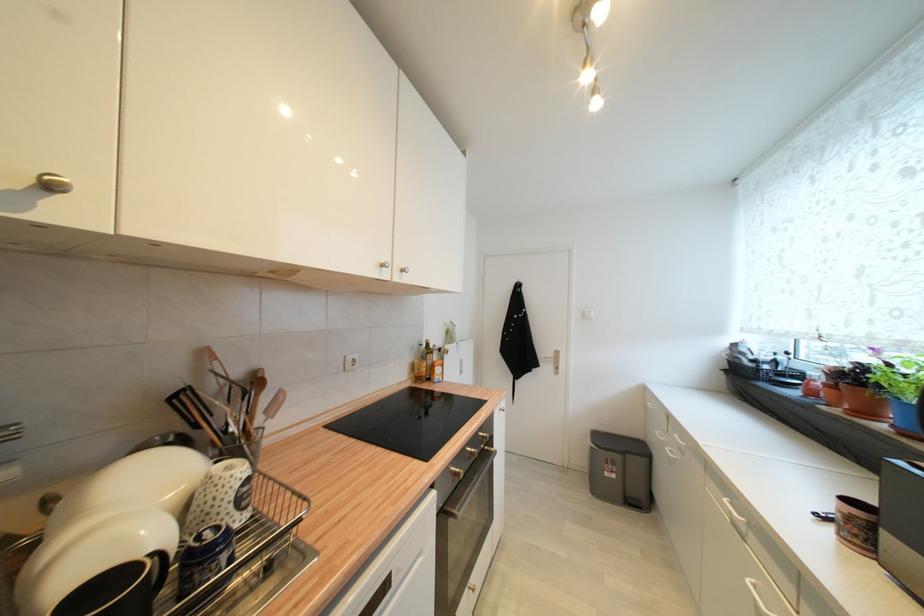
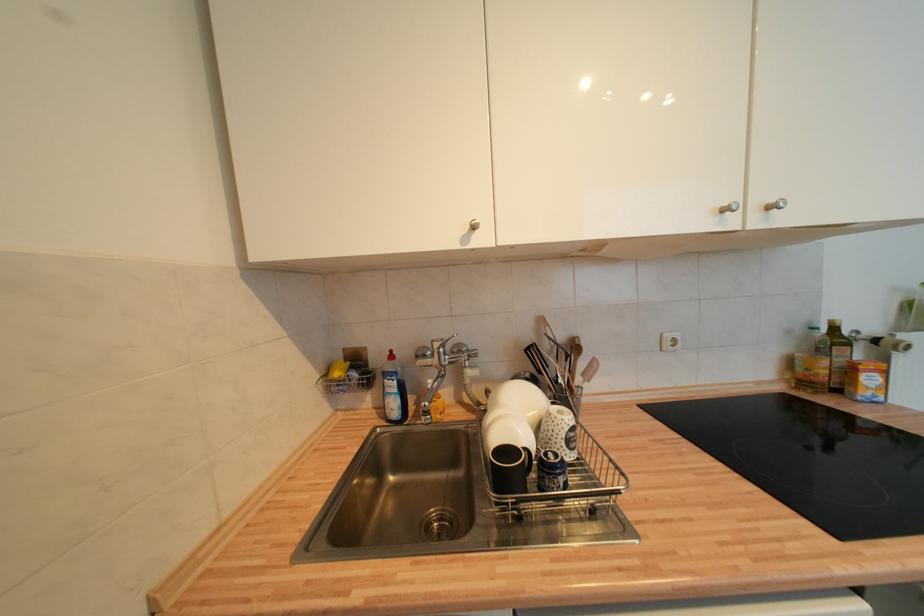
Where in the second image is the point corresponding to point (426, 347) from the first image?

(819, 331)